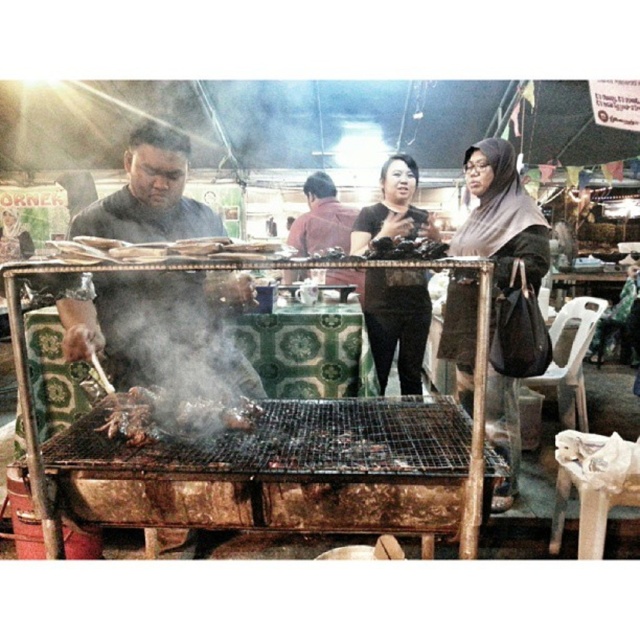
Between brown fabric hijab at center and dark red shirt at center, which one appears on the left side from the viewer's perspective?

Positioned to the left is dark red shirt at center.

Who is shorter, brown fabric hijab at center or dark red shirt at center?

Standing shorter between the two is dark red shirt at center.

This screenshot has height=640, width=640. Identify the location of brown fabric hijab at center. (500, 216).

Between matte black shirt at center and dark red shirt at center, which one is positioned lower?

Positioned lower is matte black shirt at center.

Can you confirm if matte black shirt at center is wider than dark red shirt at center?

Incorrect, matte black shirt at center's width does not surpass dark red shirt at center's.

Between point (365, 241) and point (317, 250), which one is positioned behind?

The point (317, 250) is behind.

Locate an element on the screen. This screenshot has height=640, width=640. matte black shirt at center is located at coordinates (397, 323).

How far apart are brown fabric hijab at center and matte black shirt at center?

20.21 inches

Looking at this image, between brown fabric hijab at center and matte black shirt at center, which one appears on the right side from the viewer's perspective?

brown fabric hijab at center

Who is more forward, [512,259] or [376,227]?

Point [512,259] is in front.

The image size is (640, 640). What are the coordinates of `brown fabric hijab at center` in the screenshot? It's located at (500, 216).